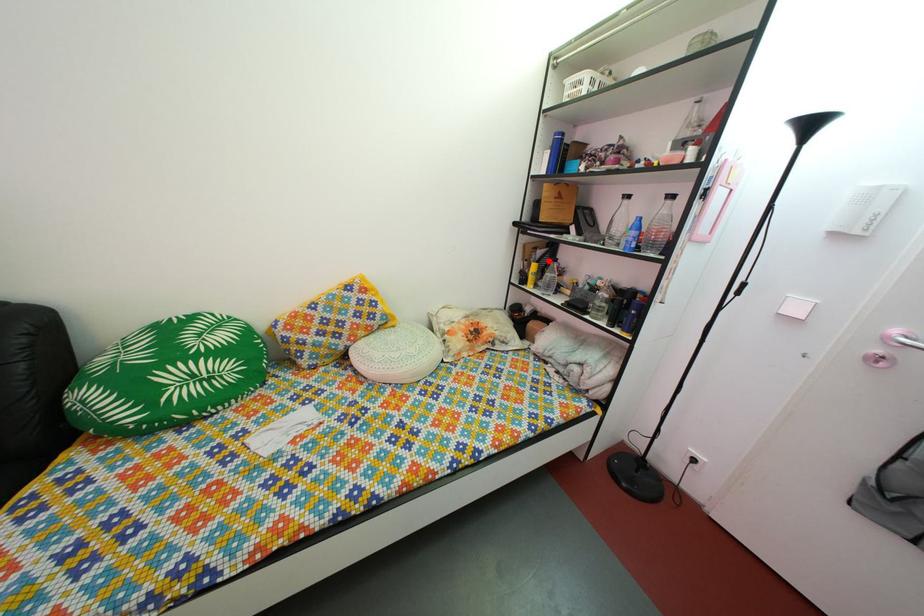
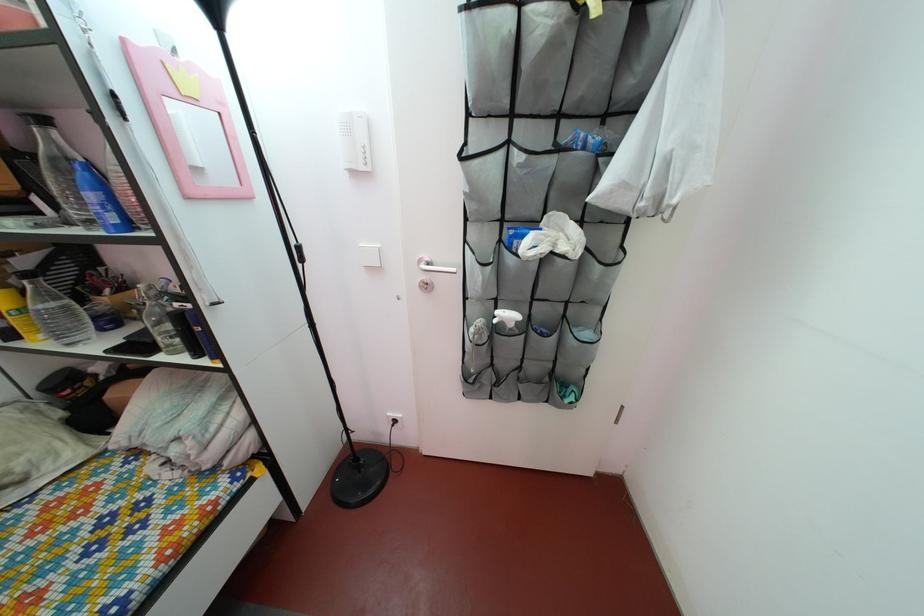
Question: I am providing you with two images of the same scene from different viewpoints. Image1 has a red point marked. In image2, the corresponding 3D location appears at what relative position? Reply with the corresponding letter.

Choices:
 (A) Closer
 (B) Farther

Answer: (B)